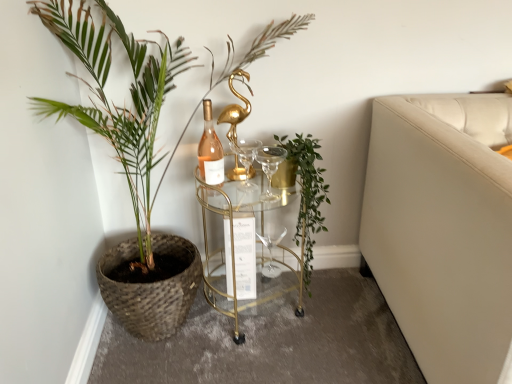
Identify the location of vacant space to the right of gold glass table at center. (344, 304).